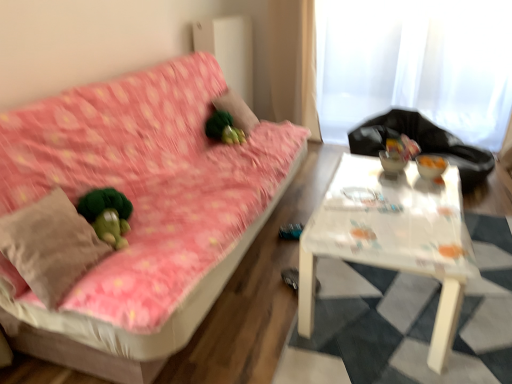
Question: From the image's perspective, is white sheer curtain at upper right above or below beige cotton throw pillow at left?

Choices:
 (A) below
 (B) above

Answer: (B)

Question: In terms of height, does white sheer curtain at upper right look taller or shorter compared to beige cotton throw pillow at left?

Choices:
 (A) tall
 (B) short

Answer: (A)

Question: Which object is positioned farthest from the beige cotton throw pillow at left?

Choices:
 (A) green fuzzy pillow at upper center
 (B) white plastic table at center
 (C) green fuzzy ball at center
 (D) black plastic bag at upper right
 (E) pink floral fabric couch at left

Answer: (D)

Question: Estimate the real-world distances between objects in this image. Which object is closer to the green fuzzy pillow at upper center?

Choices:
 (A) white sheer curtain at upper right
 (B) beige cotton throw pillow at left
 (C) white plastic table at center
 (D) black plastic bag at upper right
 (E) green fuzzy ball at center

Answer: (E)